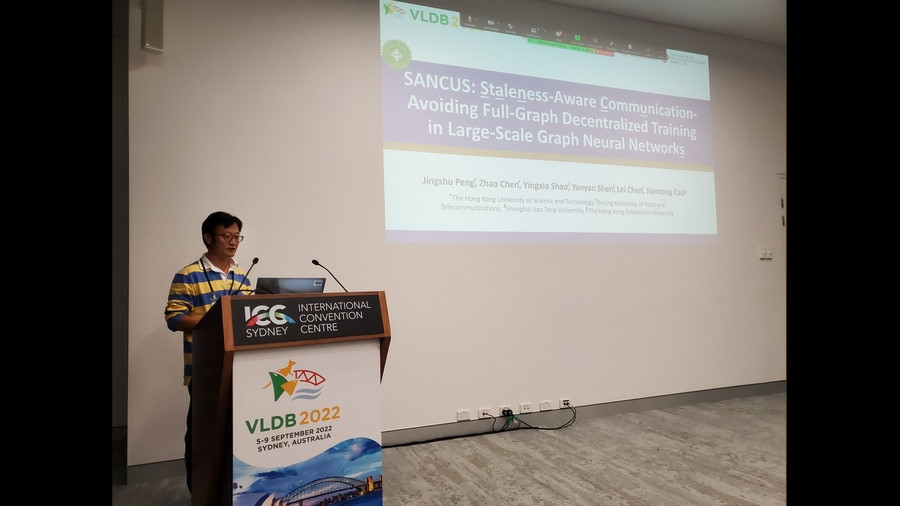
Where is `floor`? floor is located at coordinates (637, 447).